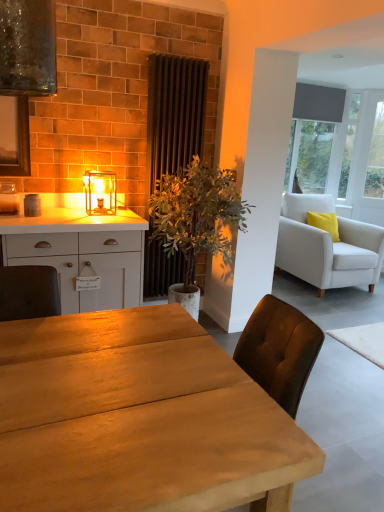
What is the approximate height of dark brown fabric radiator at center?

dark brown fabric radiator at center is 6.17 feet tall.

Describe the element at coordinates (174, 114) in the screenshot. I see `dark brown fabric radiator at center` at that location.

Image resolution: width=384 pixels, height=512 pixels. Identify the location of white fabric armchair at right. (327, 246).

What do you see at coordinates (196, 214) in the screenshot?
I see `green leafy plant at center` at bounding box center [196, 214].

Locate an element on the screen. This screenshot has height=512, width=384. dark brown fabric radiator at center is located at coordinates (174, 114).

Does white matte cabinet at left have a greater width compared to wooden table at center?

Incorrect, the width of white matte cabinet at left does not surpass that of wooden table at center.

From a real-world perspective, which is physically above, white matte cabinet at left or wooden table at center?

white matte cabinet at left.

Locate an element on the screen. The width and height of the screenshot is (384, 512). table that is on the right side of white matte cabinet at left is located at coordinates (138, 421).

Is white matte cabinet at left closer to camera compared to wooden table at center?

No, the depth of white matte cabinet at left is greater than that of wooden table at center.

Which object is thinner, white matte cabinet at left or white fabric armchair at right?

Thinner between the two is white matte cabinet at left.

Does point (98, 251) come behind point (326, 211)?

No, it is not.

Measure the distance between white matte cabinet at left and white fabric armchair at right.

The distance of white matte cabinet at left from white fabric armchair at right is 2.43 meters.

Is white fabric armchair at right at the back of white matte cabinet at left?

No, white matte cabinet at left's orientation is not away from white fabric armchair at right.

Between wooden table at center and dark brown fabric radiator at center, which one appears on the left side from the viewer's perspective?

wooden table at center is more to the left.

Between point (170, 403) and point (147, 288), which one is positioned behind?

Point (147, 288)

From a real-world perspective, is wooden table at center physically above dark brown fabric radiator at center?

Incorrect, from a real-world perspective, wooden table at center is lower than dark brown fabric radiator at center.

Which of these two, wooden table at center or dark brown fabric radiator at center, is smaller?

A: Smaller between the two is dark brown fabric radiator at center.

Considering the sizes of wooden table at center and transparent glass door at upper right in the image, is wooden table at center bigger or smaller than transparent glass door at upper right?

Clearly, wooden table at center is larger in size than transparent glass door at upper right.

Can transparent glass door at upper right be found inside wooden table at center?

That's incorrect, transparent glass door at upper right is not inside wooden table at center.

Does point (66, 453) come in front of point (359, 157)?

Yes, it is in front of point (359, 157).

Considering the positions of objects matte gray shade at upper right and white fabric armchair at right in the image provided, who is more to the right, matte gray shade at upper right or white fabric armchair at right?

white fabric armchair at right.

Relative to white fabric armchair at right, is matte gray shade at upper right in front or behind?

matte gray shade at upper right is positioned farther from the viewer than white fabric armchair at right.

Is matte gray shade at upper right surrounding white fabric armchair at right?

No.

Where is `chair that is below the matte gray shade at upper right (from the image's perspective)`? Image resolution: width=384 pixels, height=512 pixels. chair that is below the matte gray shade at upper right (from the image's perspective) is located at coordinates (327, 246).

Consider the image. Measure the distance between transparent glass door at upper right and matte gray shade at upper right.

transparent glass door at upper right is 8.77 inches away from matte gray shade at upper right.

Is transparent glass door at upper right far away from matte gray shade at upper right?

No, transparent glass door at upper right is not far from matte gray shade at upper right.

Consider the image. From a real-world perspective, is transparent glass door at upper right positioned under matte gray shade at upper right based on gravity?

Yes, from a real-world perspective, transparent glass door at upper right is beneath matte gray shade at upper right.

Considering the sizes of objects transparent glass door at upper right and matte gray shade at upper right in the image provided, who is shorter, transparent glass door at upper right or matte gray shade at upper right?

With less height is matte gray shade at upper right.

Which object is closer to the camera, dark brown fabric radiator at center or transparent glass door at upper right?

dark brown fabric radiator at center is more forward.

Is dark brown fabric radiator at center facing towards transparent glass door at upper right?

No, dark brown fabric radiator at center is not turned towards transparent glass door at upper right.

Which object is positioned more to the right, dark brown fabric radiator at center or transparent glass door at upper right?

transparent glass door at upper right.

Considering the relative sizes of dark brown fabric radiator at center and transparent glass door at upper right in the image provided, is dark brown fabric radiator at center bigger than transparent glass door at upper right?

Incorrect, dark brown fabric radiator at center is not larger than transparent glass door at upper right.

At what (x,y) coordinates should I click in order to perform the action: click on cabinetry above the wooden table at center (from a real-world perspective). Please return your answer as a coordinate pair (x, y). Looking at the image, I should click on (74, 241).

The height and width of the screenshot is (512, 384). Identify the location of cabinetry on the left of the white fabric armchair at right. (74, 241).

In the scene shown: From the image, which object appears to be farther from wooden table at center, matte glass lantern at center or white fabric armchair at right?

white fabric armchair at right.

Estimate the real-world distances between objects in this image. Which object is closer to transparent glass door at upper right, white matte cabinet at left or wooden table at center?

white matte cabinet at left is positioned closer to the anchor transparent glass door at upper right.

Considering their positions, is matte gray shade at upper right positioned further to green leafy plant at center than white matte cabinet at left?

matte gray shade at upper right.

Estimate the real-world distances between objects in this image. Which object is further from matte gray shade at upper right, dark brown fabric radiator at center or transparent glass door at upper right?

Among the two, dark brown fabric radiator at center is located further to matte gray shade at upper right.

Considering their positions, is matte glass lantern at center positioned further to white fabric armchair at right than transparent glass door at upper right?

matte glass lantern at center.

Based on their spatial positions, is transparent glass door at upper right or wooden table at center closer to dark brown fabric radiator at center?

Among the two, wooden table at center is located nearer to dark brown fabric radiator at center.

When comparing their distances from matte gray shade at upper right, does transparent glass door at upper right or green leafy plant at center seem closer?

Based on the image, transparent glass door at upper right appears to be nearer to matte gray shade at upper right.

When comparing their distances from white matte cabinet at left, does transparent glass door at upper right or matte gray shade at upper right seem closer?

matte gray shade at upper right lies closer to white matte cabinet at left than the other object.

The image size is (384, 512). In order to click on window between green leafy plant at center and transparent glass door at upper right from front to back in this screenshot , I will do `click(339, 149)`.

Where is `houseplant between wooden table at center and white fabric armchair at right along the z-axis`? houseplant between wooden table at center and white fabric armchair at right along the z-axis is located at coordinates (196, 214).

You are a GUI agent. You are given a task and a screenshot of the screen. Output one action in this format:
    pyautogui.click(x=<x>, y=<y>)
    Task: Click on the curtain between white matte cabinet at left and transparent glass door at upper right in the horizontal direction
    The image size is (384, 512).
    Given the screenshot: What is the action you would take?
    pyautogui.click(x=174, y=114)

Locate an element on the screen. The width and height of the screenshot is (384, 512). light fixture between white matte cabinet at left and transparent glass door at upper right is located at coordinates (100, 192).